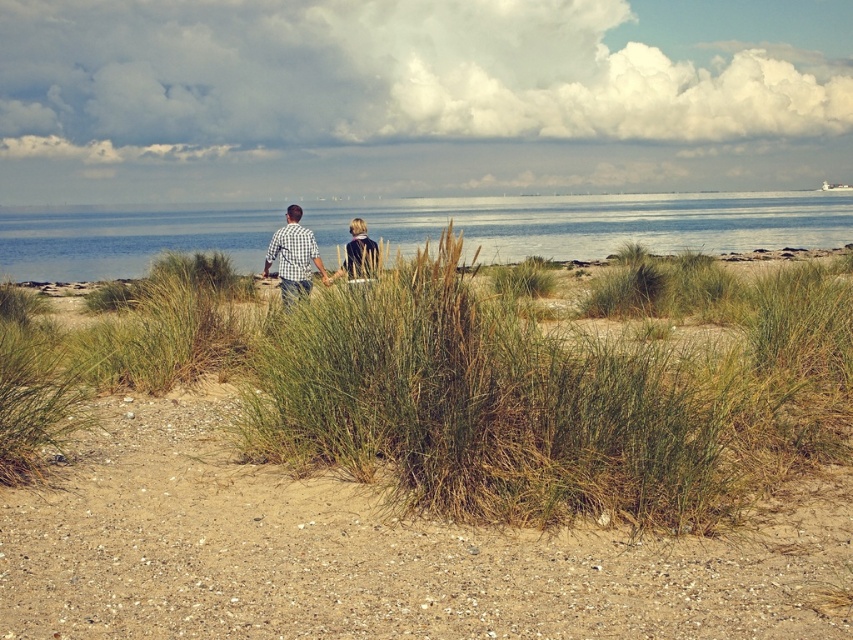
Question: Which of these objects is positioned farthest from the dark blue jacket at center?

Choices:
 (A) brown sandy soil at lower center
 (B) checkered fabric shirt at center

Answer: (A)

Question: Based on their relative distances, which object is farther from the brown sandy soil at lower center?

Choices:
 (A) dark blue jacket at center
 (B) checkered fabric shirt at center

Answer: (B)

Question: Is checkered fabric shirt at center wider than dark blue jacket at center?

Choices:
 (A) no
 (B) yes

Answer: (A)

Question: Is brown sandy soil at lower center positioned at the back of checkered fabric shirt at center?

Choices:
 (A) no
 (B) yes

Answer: (A)

Question: Can you confirm if checkered fabric shirt at center is positioned to the left of dark blue jacket at center?

Choices:
 (A) yes
 (B) no

Answer: (A)

Question: Which object is positioned farthest from the dark blue jacket at center?

Choices:
 (A) checkered fabric shirt at center
 (B) brown sandy soil at lower center

Answer: (B)